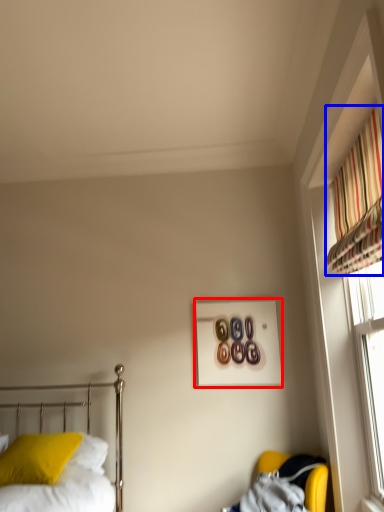
Question: Which object appears farthest to the camera in this image, picture frame (highlighted by a red box) or curtain (highlighted by a blue box)?

Choices:
 (A) picture frame
 (B) curtain

Answer: (A)